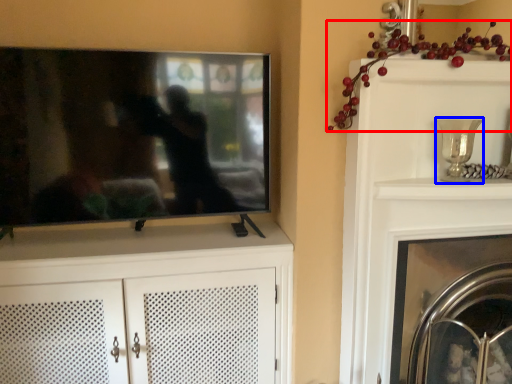
Question: Which object appears closest to the camera in this image, fruit (highlighted by a red box) or candle holder (highlighted by a blue box)?

Choices:
 (A) fruit
 (B) candle holder

Answer: (A)